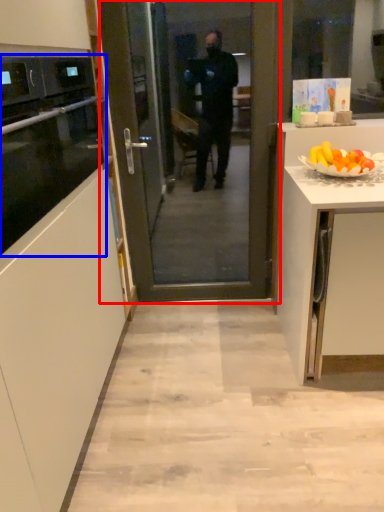
Question: Which object is further to the camera taking this photo, screen door (highlighted by a red box) or oven (highlighted by a blue box)?

Choices:
 (A) screen door
 (B) oven

Answer: (A)